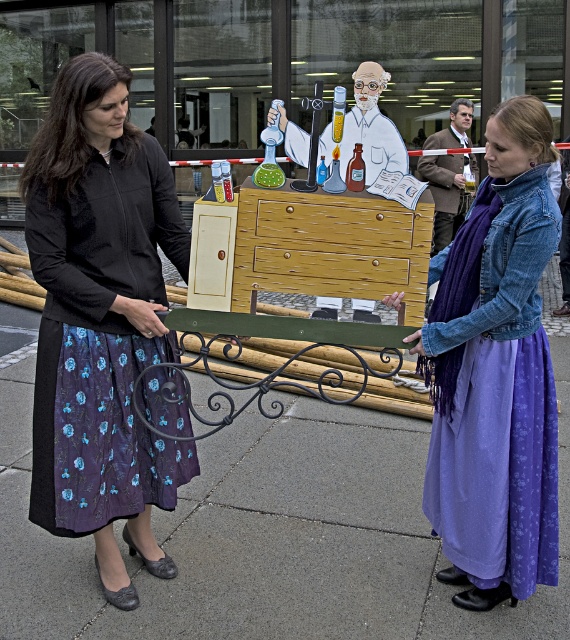
You are standing on the concrete pavement at center and looking up at the velvet black blouse at left. Which object is taller?

The velvet black blouse at left is taller than the concrete pavement at center.

You are organizing an exhibition and need to place a new item between the wooden cabinet at center and the brown leather jacket at center. Based on their positions, which object should the new item be placed to the right of?

The new item should be placed to the right of the wooden cabinet at center because the wooden cabinet at center is to the left of the brown leather jacket at center.